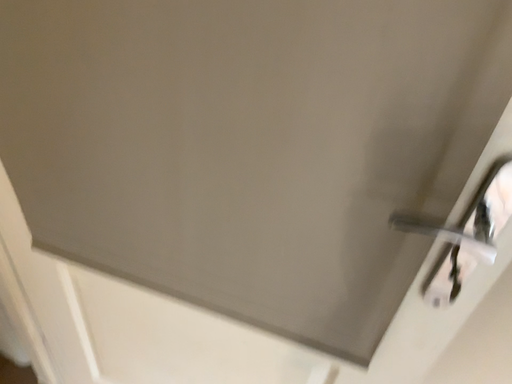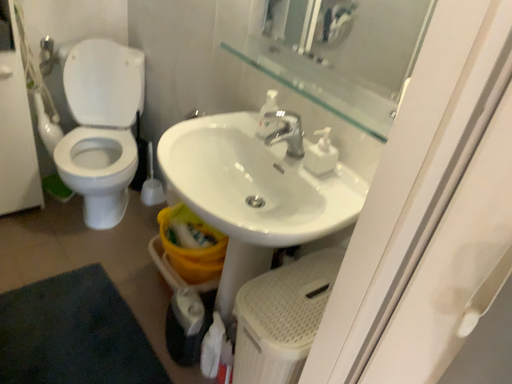
Question: Which way did the camera rotate in the video?

Choices:
 (A) rotated upward
 (B) rotated downward

Answer: (A)